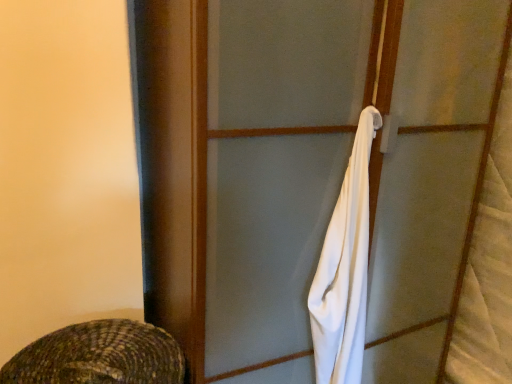
Question: Is white cloth at right with white fabric at center?

Choices:
 (A) no
 (B) yes

Answer: (A)

Question: Can you confirm if white cloth at right is positioned to the left of white fabric at center?

Choices:
 (A) yes
 (B) no

Answer: (B)

Question: From a real-world perspective, is white cloth at right located higher than white fabric at center?

Choices:
 (A) no
 (B) yes

Answer: (B)

Question: Does white cloth at right have a lesser width compared to white fabric at center?

Choices:
 (A) yes
 (B) no

Answer: (A)

Question: Is white fabric at center a part of white cloth at right?

Choices:
 (A) no
 (B) yes

Answer: (A)

Question: Considering the relative sizes of white cloth at right and white fabric at center in the image provided, is white cloth at right shorter than white fabric at center?

Choices:
 (A) yes
 (B) no

Answer: (A)

Question: Is white fabric at center bigger than white cloth at right?

Choices:
 (A) yes
 (B) no

Answer: (A)

Question: Considering the relative sizes of white fabric at center and white cloth at right in the image provided, is white fabric at center wider than white cloth at right?

Choices:
 (A) yes
 (B) no

Answer: (A)

Question: Can you confirm if white fabric at center is smaller than white cloth at right?

Choices:
 (A) yes
 (B) no

Answer: (B)

Question: Is white fabric at center not near white cloth at right?

Choices:
 (A) no
 (B) yes

Answer: (A)

Question: Does white fabric at center appear on the right side of white cloth at right?

Choices:
 (A) no
 (B) yes

Answer: (A)

Question: From a real-world perspective, is white fabric at center beneath white cloth at right?

Choices:
 (A) yes
 (B) no

Answer: (A)

Question: Is white cloth at right in front of or behind white fabric at center in the image?

Choices:
 (A) behind
 (B) front

Answer: (A)